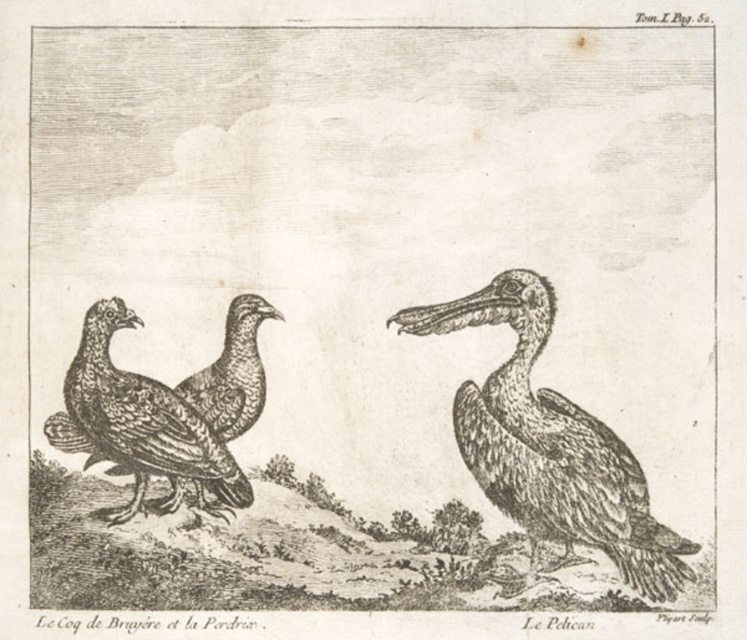
Question: Does gray textured pelican at center have a larger size compared to smooth gray beak at center right?

Choices:
 (A) no
 (B) yes

Answer: (B)

Question: Which of the following is the closest to the observer?

Choices:
 (A) (258, 410)
 (B) (663, 532)

Answer: (B)

Question: Which of these objects is positioned closest to the smooth gray beak at center right?

Choices:
 (A) gray textured pelican at center
 (B) brown textured birds at left

Answer: (A)

Question: Does brown textured birds at left appear on the left side of smooth gray beak at center right?

Choices:
 (A) no
 (B) yes

Answer: (B)

Question: Is gray textured pelican at center above brown textured birds at left?

Choices:
 (A) no
 (B) yes

Answer: (A)

Question: Which of the following is the closest to the observer?

Choices:
 (A) (456, 328)
 (B) (238, 352)

Answer: (B)